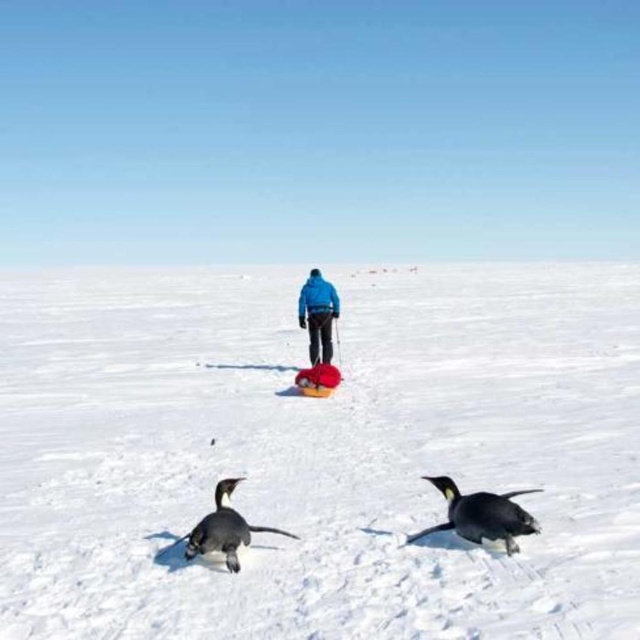
You are an observer looking at the winter scene. You notice the white fluffy snow at center and the blue fabric jacket at center. Which object is positioned higher in the image?

The white fluffy snow at center is above the blue fabric jacket at center, so it is positioned higher in the image.

You are a photographer trying to capture both the black matte penguin at lower right and the black glossy penguin at lower left in a single shot. Since you want to ensure both are clearly visible, which penguin is closer to you and might require adjusting your focus?

The black matte penguin at lower right is closer to you than the black glossy penguin at lower left, so you should adjust your focus to ensure clarity for the closer penguin.

You are an animal researcher observing two emperor penguins in a snowy landscape. You notice the black matte penguin at lower right and the black glossy penguin at lower left. Which penguin is shorter?

The black matte penguin at lower right is shorter than the black glossy penguin at lower left.